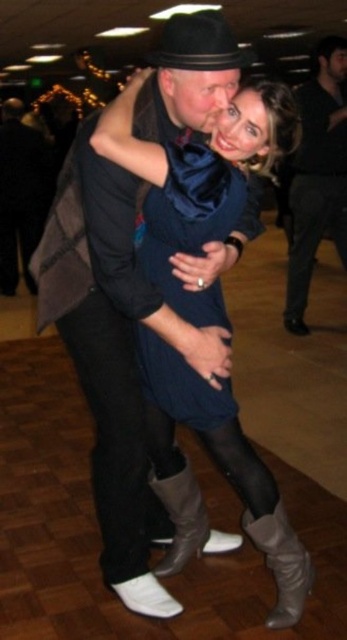
Question: Where is gray suede boot at lower center located in relation to black felt fedora at upper center in the image?

Choices:
 (A) left
 (B) right

Answer: (A)

Question: Which object is the closest to the dark blue wool vest at left?

Choices:
 (A) black felt fedora at upper center
 (B) gray suede boot at lower center

Answer: (B)

Question: Which point is farther from the camera taking this photo?

Choices:
 (A) (247, 49)
 (B) (158, 371)
 (C) (154, 474)
 (D) (297, 536)

Answer: (A)

Question: Is dark gray textured pants at center bigger than silver metallic boot at lower center?

Choices:
 (A) no
 (B) yes

Answer: (B)

Question: Is velvet blue dress at center below silver metallic boot at lower center?

Choices:
 (A) no
 (B) yes

Answer: (A)

Question: Which point is closer to the camera?

Choices:
 (A) silver metallic boot at lower center
 (B) velvet blue dress at center
 (C) dark gray textured pants at center
 (D) black felt fedora at upper center

Answer: (D)